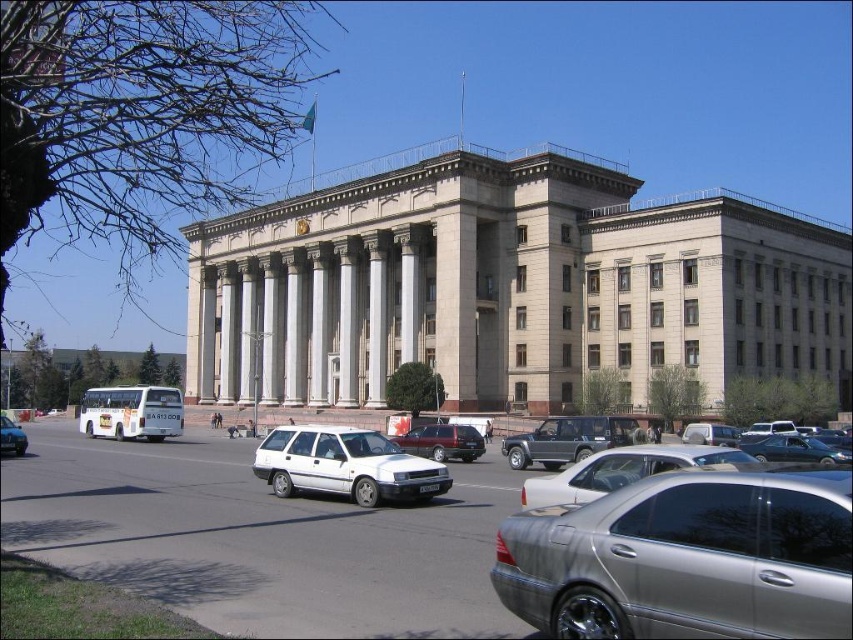
Can you confirm if silver metallic sedan at lower right is smaller than satin silver sedan at center?

Yes, silver metallic sedan at lower right is smaller than satin silver sedan at center.

Which is more to the left, silver metallic sedan at lower right or satin silver sedan at center?

silver metallic sedan at lower right is more to the left.

Between point (796, 576) and point (733, 432), which one is positioned in front?

Point (796, 576) is more forward.

I want to click on silver metallic sedan at lower right, so click(x=685, y=557).

Based on the photo, who is taller, silver metallic sedan at center or white matte sedan at center?

Standing taller between the two is silver metallic sedan at center.

Does silver metallic sedan at center appear under white matte sedan at center?

Indeed, silver metallic sedan at center is positioned under white matte sedan at center.

Where is `silver metallic sedan at center`? silver metallic sedan at center is located at coordinates (622, 470).

Who is taller, silver metallic sedan at lower right or white matte sedan at center?

white matte sedan at center is taller.

Who is higher up, silver metallic sedan at lower right or white matte sedan at center?

Positioned higher is silver metallic sedan at lower right.

Who is more distant from viewer, (653, 563) or (0, 417)?

Point (0, 417)

Locate an element on the screen. Image resolution: width=853 pixels, height=640 pixels. silver metallic sedan at lower right is located at coordinates (685, 557).